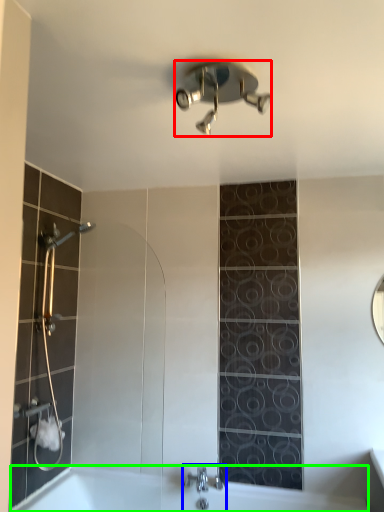
Question: Which is farther away from shower (highlighted by a red box)? tap (highlighted by a blue box) or bath (highlighted by a green box)?

Choices:
 (A) tap
 (B) bath

Answer: (B)